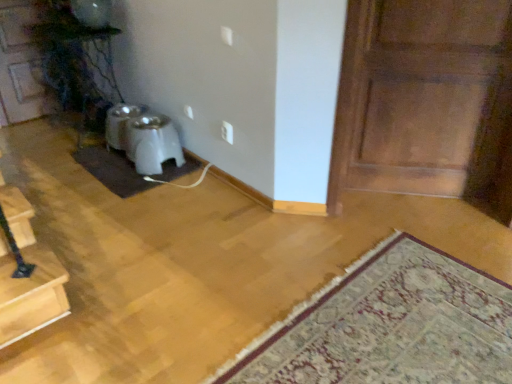
Where is `free point above white plastic pet feeder at center (from a real-world perspective)`? This screenshot has width=512, height=384. free point above white plastic pet feeder at center (from a real-world perspective) is located at coordinates (143, 122).